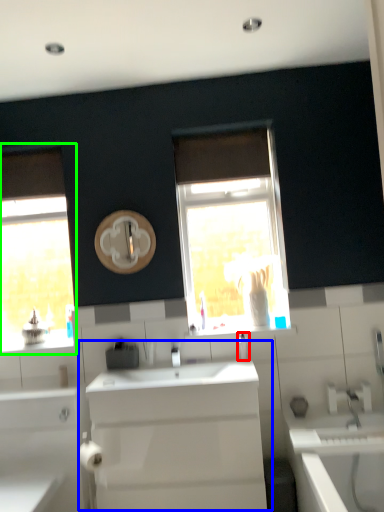
Question: Which object is positioned farthest from soap dispenser (highlighted by a red box)? Select from sink (highlighted by a blue box) and window (highlighted by a green box).

Choices:
 (A) sink
 (B) window

Answer: (B)